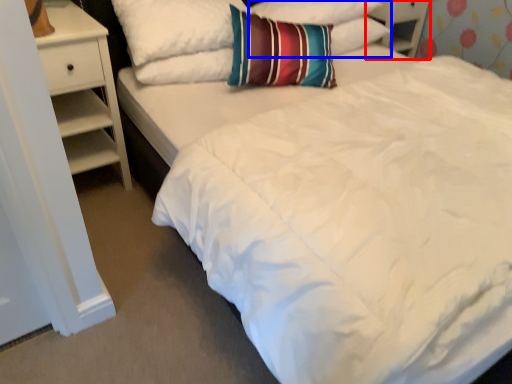
Question: Which of the following is the closest to the observer, dresser (highlighted by a red box) or pillow (highlighted by a blue box)?

Choices:
 (A) dresser
 (B) pillow

Answer: (B)